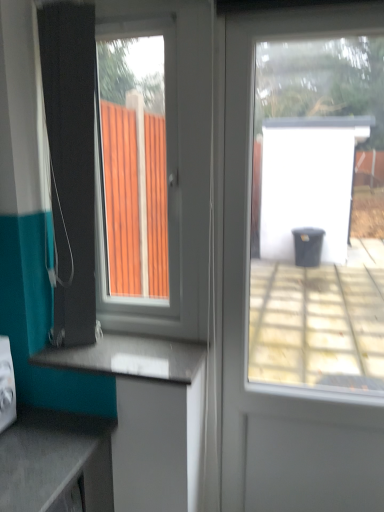
Find the location of a particular element. The image size is (384, 512). transparent glass door at center is located at coordinates (247, 330).

The height and width of the screenshot is (512, 384). Find the location of `smooth gray countertop at lower center`. smooth gray countertop at lower center is located at coordinates (129, 357).

This screenshot has height=512, width=384. What do you see at coordinates (107, 169) in the screenshot?
I see `white plastic window at left` at bounding box center [107, 169].

I want to click on teal fabric shower curtain at left, so click(71, 163).

Considering the sizes of smooth gray countertop at lower center and teal fabric shower curtain at left in the image, is smooth gray countertop at lower center bigger or smaller than teal fabric shower curtain at left?

Considering their sizes, smooth gray countertop at lower center takes up less space than teal fabric shower curtain at left.

From a real-world perspective, between smooth gray countertop at lower center and teal fabric shower curtain at left, who is vertically lower?

In real-world perspective, smooth gray countertop at lower center is lower.

Consider the image. Between smooth gray countertop at lower center and teal fabric shower curtain at left, which one appears on the right side from the viewer's perspective?

Positioned to the right is smooth gray countertop at lower center.

Can you tell me how much smooth gray countertop at lower center and teal fabric shower curtain at left differ in facing direction?

The angular difference between smooth gray countertop at lower center and teal fabric shower curtain at left is 0.277 degrees.

At what (x,y) coordinates should I click in order to perform the action: click on counter top behind the white plastic window at left. Please return your answer as a coordinate pair (x, y). Looking at the image, I should click on (129, 357).

Would you say smooth gray countertop at lower center contains white plastic window at left?

No, white plastic window at left is located outside of smooth gray countertop at lower center.

From a real-world perspective, is smooth gray countertop at lower center on top of white plastic window at left?

No, from a real-world perspective, smooth gray countertop at lower center is not above white plastic window at left.

Is teal fabric shower curtain at left placed right next to white plastic window at left?

Yes, teal fabric shower curtain at left is next to white plastic window at left.

How different are the orientations of teal fabric shower curtain at left and white plastic window at left in degrees?

The facing directions of teal fabric shower curtain at left and white plastic window at left are 0.569 degrees apart.

Locate an element on the screen. window above the teal fabric shower curtain at left (from the image's perspective) is located at coordinates (107, 169).

Is teal fabric shower curtain at left facing towards white plastic window at left?

No, teal fabric shower curtain at left is not facing towards white plastic window at left.

Is transparent glass door at center wider or thinner than white plastic window at left?

Considering their sizes, transparent glass door at center looks slimmer than white plastic window at left.

Is transparent glass door at center aimed at white plastic window at left?

No, transparent glass door at center does not turn towards white plastic window at left.

Does point (231, 348) come behind point (144, 320)?

No, (231, 348) is closer to viewer.

Considering the relative sizes of transparent glass door at center and white plastic window at left in the image provided, is transparent glass door at center shorter than white plastic window at left?

In fact, transparent glass door at center may be taller than white plastic window at left.

Considering the relative sizes of teal fabric shower curtain at left and smooth gray countertop at lower center in the image provided, is teal fabric shower curtain at left shorter than smooth gray countertop at lower center?

In fact, teal fabric shower curtain at left may be taller than smooth gray countertop at lower center.

Considering the relative sizes of teal fabric shower curtain at left and smooth gray countertop at lower center in the image provided, is teal fabric shower curtain at left bigger than smooth gray countertop at lower center?

Correct, teal fabric shower curtain at left is larger in size than smooth gray countertop at lower center.

What are the coordinates of `counter top below the teal fabric shower curtain at left (from a real-world perspective)` in the screenshot? It's located at (129, 357).

Considering the positions of objects teal fabric shower curtain at left and smooth gray countertop at lower center in the image provided, who is more to the right, teal fabric shower curtain at left or smooth gray countertop at lower center?

smooth gray countertop at lower center.

Based on their sizes in the image, would you say white plastic window at left is bigger or smaller than transparent glass door at center?

white plastic window at left is bigger than transparent glass door at center.

Would you consider white plastic window at left to be distant from transparent glass door at center?

No, there isn't a large distance between white plastic window at left and transparent glass door at center.

From the image's perspective, relative to transparent glass door at center, is white plastic window at left above or below?

Based on their image positions, white plastic window at left is located above transparent glass door at center.

Does white plastic window at left have a smaller size compared to teal fabric shower curtain at left?

Incorrect, white plastic window at left is not smaller in size than teal fabric shower curtain at left.

Which is nearer, (x=178, y=176) or (x=63, y=109)?

Point (x=178, y=176) is positioned farther from the camera compared to point (x=63, y=109).

Could you tell me if white plastic window at left is facing teal fabric shower curtain at left?

Yes.

From the image's perspective, would you say white plastic window at left is positioned over teal fabric shower curtain at left?

Yes, from the image's perspective, white plastic window at left is over teal fabric shower curtain at left.

I want to click on counter top that appears on the right of teal fabric shower curtain at left, so click(129, 357).

Identify the location of counter top below the white plastic window at left (from a real-world perspective). The image size is (384, 512). (129, 357).

Based on their spatial positions, is white plastic window at left or smooth gray countertop at lower center closer to transparent glass door at center?

Among the two, white plastic window at left is located nearer to transparent glass door at center.

From the image, which object appears to be farther from smooth gray countertop at lower center, white plastic window at left or transparent glass door at center?

transparent glass door at center is further to smooth gray countertop at lower center.

Looking at the image, which one is located closer to teal fabric shower curtain at left, white plastic window at left or transparent glass door at center?

Based on the image, white plastic window at left appears to be nearer to teal fabric shower curtain at left.

Considering their positions, is teal fabric shower curtain at left positioned closer to transparent glass door at center than white plastic window at left?

The object closer to transparent glass door at center is white plastic window at left.

Which object lies nearer to the anchor point smooth gray countertop at lower center, transparent glass door at center or teal fabric shower curtain at left?

Among the two, teal fabric shower curtain at left is located nearer to smooth gray countertop at lower center.

Based on the photo, considering their positions, is teal fabric shower curtain at left positioned closer to smooth gray countertop at lower center than white plastic window at left?

white plastic window at left is closer to smooth gray countertop at lower center.

Based on their spatial positions, is white plastic window at left or teal fabric shower curtain at left closer to transparent glass door at center?

white plastic window at left is closer to transparent glass door at center.

When comparing their distances from white plastic window at left, does teal fabric shower curtain at left or transparent glass door at center seem closer?

Based on the image, teal fabric shower curtain at left appears to be nearer to white plastic window at left.

Find the location of a particular element. The width and height of the screenshot is (384, 512). window situated between teal fabric shower curtain at left and transparent glass door at center from left to right is located at coordinates coord(107,169).

You are a GUI agent. You are given a task and a screenshot of the screen. Output one action in this format:
    pyautogui.click(x=<x>, y=<y>)
    Task: Click on the shower curtain that lies between white plastic window at left and smooth gray countertop at lower center from top to bottom
    The width and height of the screenshot is (384, 512).
    Given the screenshot: What is the action you would take?
    tap(71, 163)

In order to click on counter top between teal fabric shower curtain at left and transparent glass door at center from left to right in this screenshot , I will do coord(129,357).

What are the coordinates of `window between smooth gray countertop at lower center and transparent glass door at center in the horizontal direction` in the screenshot? It's located at (107, 169).